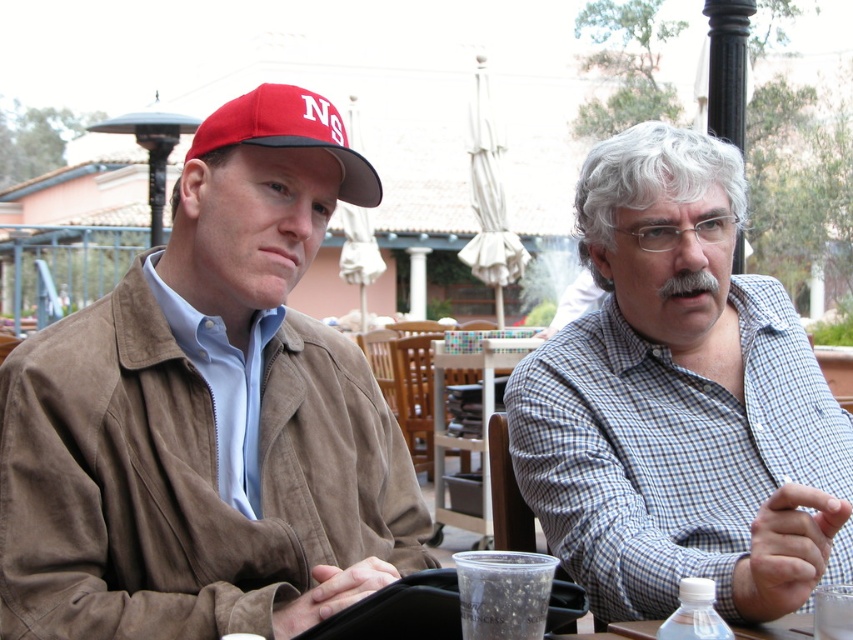
Can you confirm if suede jacket at left is positioned to the right of wooden table at center?

In fact, suede jacket at left is to the left of wooden table at center.

Where is `suede jacket at left`? This screenshot has width=853, height=640. suede jacket at left is located at coordinates (207, 416).

Is suede jacket at left above red matte baseball cap at upper left?

No.

Which is in front, point (155, 340) or point (369, 177)?

Positioned in front is point (155, 340).

You are a GUI agent. You are given a task and a screenshot of the screen. Output one action in this format:
    pyautogui.click(x=<x>, y=<y>)
    Task: Click on the suede jacket at left
    
    Given the screenshot: What is the action you would take?
    coord(207,416)

Identify the location of suede jacket at left. (207, 416).

Between blue checkered shirt at right and clear plastic bottle at lower right, which one has more height?

blue checkered shirt at right is taller.

Does blue checkered shirt at right come in front of clear plastic bottle at lower right?

That is False.

Does point (612, 545) lie behind point (695, 602)?

Yes, it is behind point (695, 602).

You are a GUI agent. You are given a task and a screenshot of the screen. Output one action in this format:
    pyautogui.click(x=<x>, y=<y>)
    Task: Click on the blue checkered shirt at right
    Image resolution: width=853 pixels, height=640 pixels.
    Given the screenshot: What is the action you would take?
    pyautogui.click(x=680, y=401)